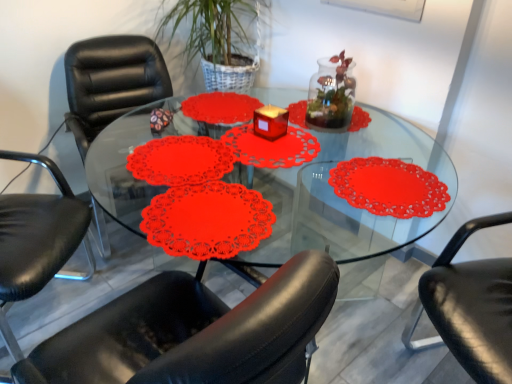
Question: Would you say transparent glass terrarium at center is inside or outside matte red candle at center?

Choices:
 (A) outside
 (B) inside

Answer: (A)

Question: In terms of size, does transparent glass terrarium at center appear bigger or smaller than matte red candle at center?

Choices:
 (A) small
 (B) big

Answer: (B)

Question: Based on their relative distances, which object is nearer to the black leather chair at left, the second chair when ordered from left to right?

Choices:
 (A) black leather chair at lower right, which is counted as the first chair, starting from the right
 (B) transparent glass terrarium at center
 (C) matte red candle at center
 (D) black leather chair at left, which is the third chair from right to left
 (E) transparent glass table at center

Answer: (D)

Question: Considering the real-world distances, which object is farthest from the transparent glass table at center?

Choices:
 (A) black leather chair at lower right, the 3th chair when ordered from left to right
 (B) matte red candle at center
 (C) transparent glass terrarium at center
 (D) black leather chair at left, which is counted as the first chair, starting from the left
 (E) black leather chair at left, the second chair positioned from the right

Answer: (D)